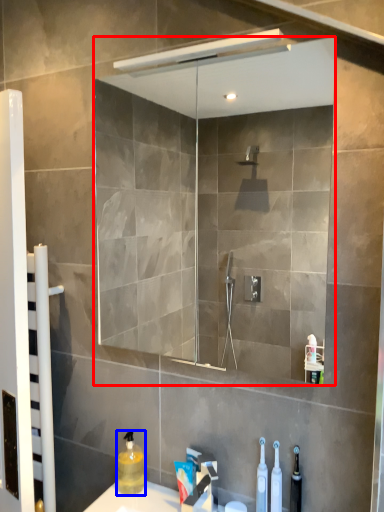
Question: Which point is closer to the camera, mirror (highlighted by a red box) or cleaning product (highlighted by a blue box)?

Choices:
 (A) mirror
 (B) cleaning product

Answer: (A)